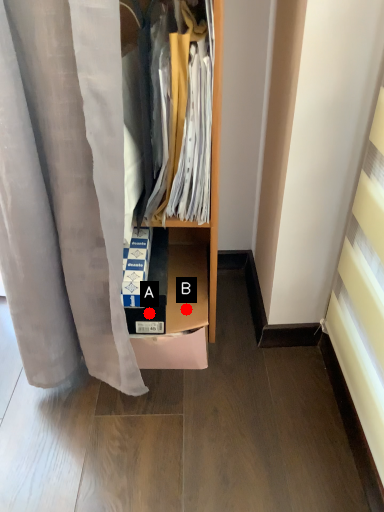
Question: Two points are circled on the image, labeled by A and B beside each circle. Which point appears closest to the camera in this image?

Choices:
 (A) A is closer
 (B) B is closer

Answer: (A)